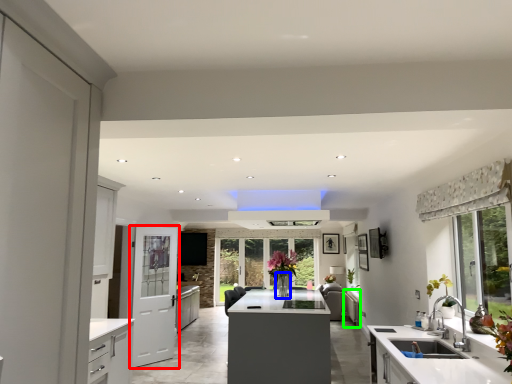
Question: Which object is positioned farthest from door (highlighted by a red box)? Select from vase (highlighted by a blue box) and cabinetry (highlighted by a green box).

Choices:
 (A) vase
 (B) cabinetry

Answer: (B)